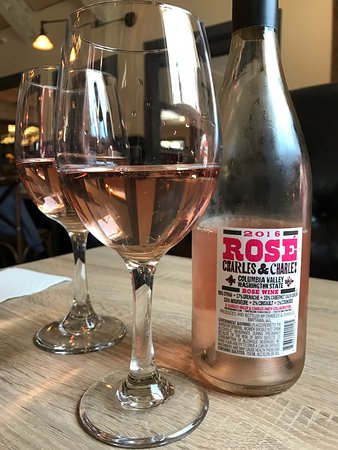
The width and height of the screenshot is (338, 450). Identify the location of wine glasses. (132, 209), (42, 153).